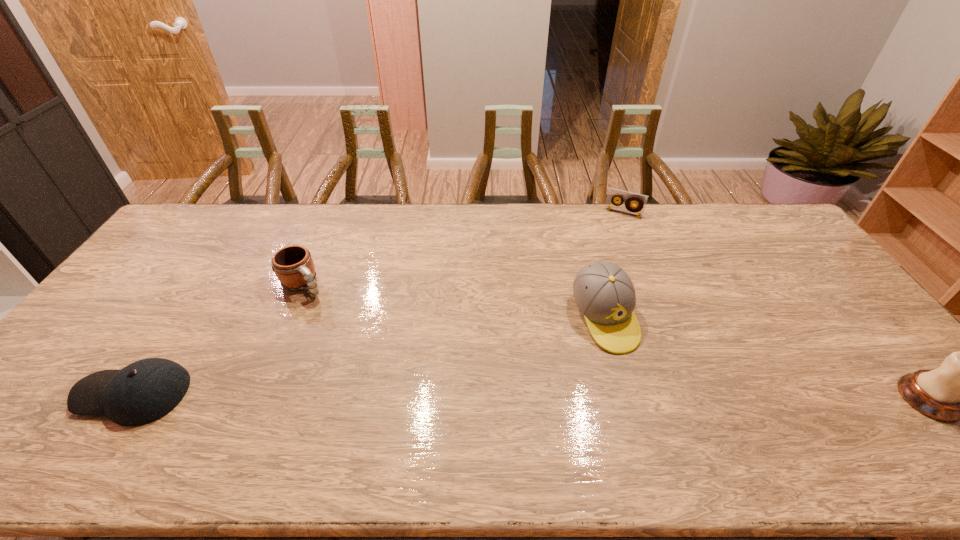
The width and height of the screenshot is (960, 540). Identify the location of the nearer baseball cap. (142, 392).

At what (x,y) coordinates should I click in order to perform the action: click on the leftmost object. Please return your answer as a coordinate pair (x, y). The image size is (960, 540). Looking at the image, I should click on (142, 392).

In order to click on the fourth object from left to right in this screenshot , I will do `click(640, 200)`.

Find the location of `the farthest object`. the farthest object is located at coordinates (640, 200).

The width and height of the screenshot is (960, 540). What are the coordinates of `mug` in the screenshot? It's located at (293, 265).

Find the location of a particular element. This screenshot has width=960, height=540. the right baseball cap is located at coordinates (604, 293).

The image size is (960, 540). Identify the location of the farther baseball cap. (604, 293).

Where is `free space located 0.160m at the front of the fourth object from left to right with visible reels`? This screenshot has width=960, height=540. free space located 0.160m at the front of the fourth object from left to right with visible reels is located at coordinates (609, 243).

I want to click on vacant area situated at the front of the fourth object from left to right with visible reels, so click(x=613, y=230).

This screenshot has width=960, height=540. Find the location of `free region located at the front of the fourth object from left to right with visible reels`. free region located at the front of the fourth object from left to right with visible reels is located at coordinates (604, 255).